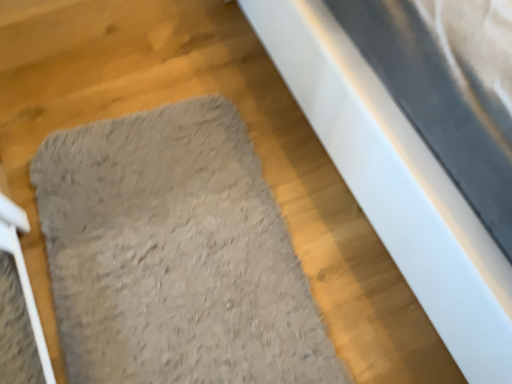
Where is `gray textured mat at center`? This screenshot has height=384, width=512. gray textured mat at center is located at coordinates (174, 254).

What do you see at coordinates (174, 254) in the screenshot?
I see `gray textured mat at center` at bounding box center [174, 254].

I want to click on gray textured mat at center, so click(x=174, y=254).